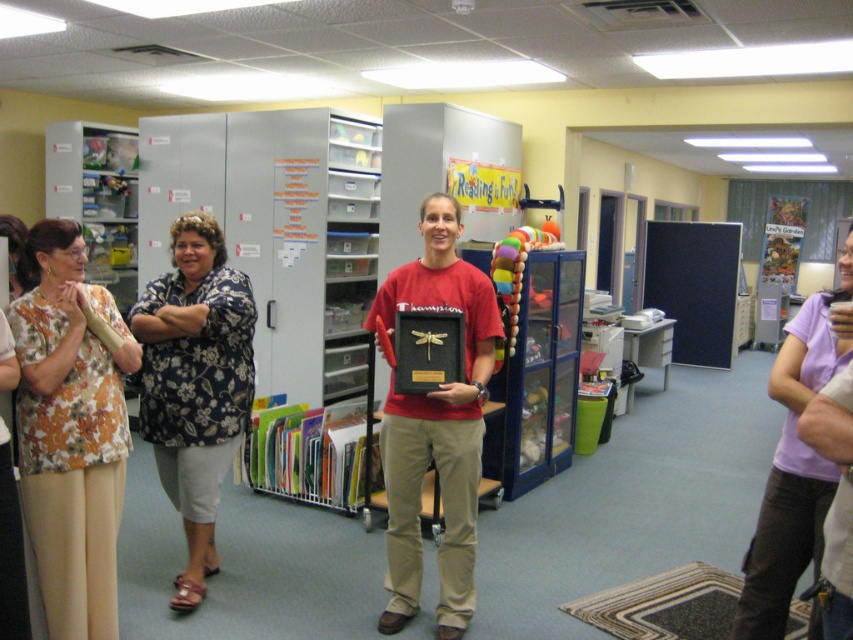
Question: Which point is closer to the camera?

Choices:
 (A) (788, 332)
 (B) (113, 545)

Answer: (A)

Question: Which object appears closest to the camera in this image?

Choices:
 (A) purple cotton shirt at right
 (B) floral fabric blouse at left
 (C) matte red t-shirt at center
 (D) floral print blouse at left

Answer: (A)

Question: In this image, where is matte red t-shirt at center located relative to floral fabric blouse at left?

Choices:
 (A) below
 (B) above

Answer: (A)

Question: Can you confirm if matte red t-shirt at center is positioned below purple cotton shirt at right?

Choices:
 (A) no
 (B) yes

Answer: (A)

Question: Which point is closer to the camera?

Choices:
 (A) (454, 227)
 (B) (845, 307)

Answer: (B)

Question: Does matte red t-shirt at center have a lesser width compared to purple cotton shirt at right?

Choices:
 (A) yes
 (B) no

Answer: (B)